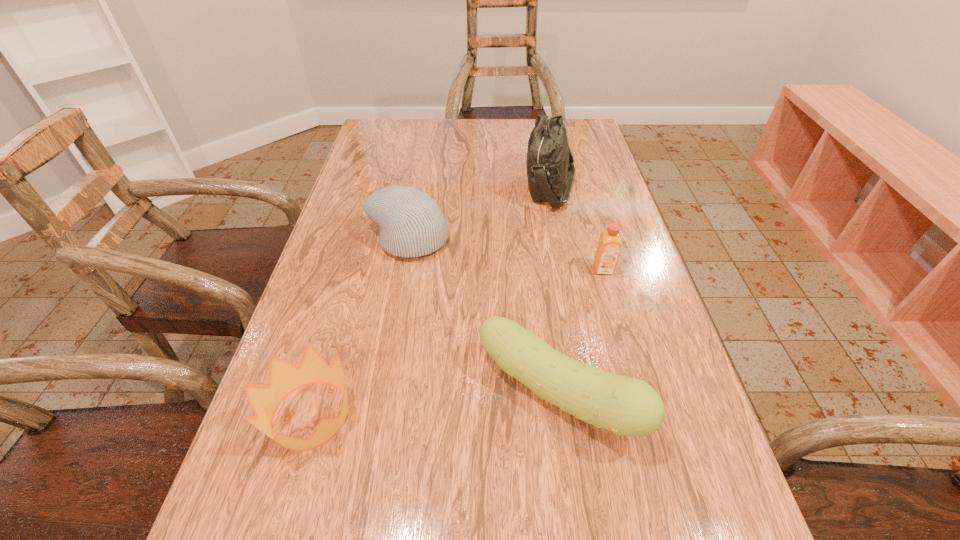
I want to click on the farthest object, so click(x=550, y=166).

What are the coordinates of `the tallest object` in the screenshot? It's located at (550, 166).

Find the location of a particular element. The width and height of the screenshot is (960, 540). beanie is located at coordinates (411, 224).

The width and height of the screenshot is (960, 540). In order to click on orange juice in this screenshot , I will do `click(610, 242)`.

You are a GUI agent. You are given a task and a screenshot of the screen. Output one action in this format:
    pyautogui.click(x=<x>, y=<y>)
    Task: Click on the cucumber
    This screenshot has width=960, height=540.
    Given the screenshot: What is the action you would take?
    pyautogui.click(x=626, y=406)

Find the location of a particular element. crown is located at coordinates (284, 377).

At what (x,y) coordinates should I click in order to perform the action: click on vacant space located at the front padded panel of the tallest object. Please return your answer as a coordinate pair (x, y). This screenshot has width=960, height=540. Looking at the image, I should click on (410, 186).

What are the coordinates of `free space located at the front padded panel of the tallest object` in the screenshot? It's located at (414, 186).

The height and width of the screenshot is (540, 960). In order to click on free space located at the front padded panel of the tallest object in this screenshot , I will do `click(417, 186)`.

Where is `vacant space situated 0.370m on the right of the beanie`? The height and width of the screenshot is (540, 960). vacant space situated 0.370m on the right of the beanie is located at coordinates (599, 239).